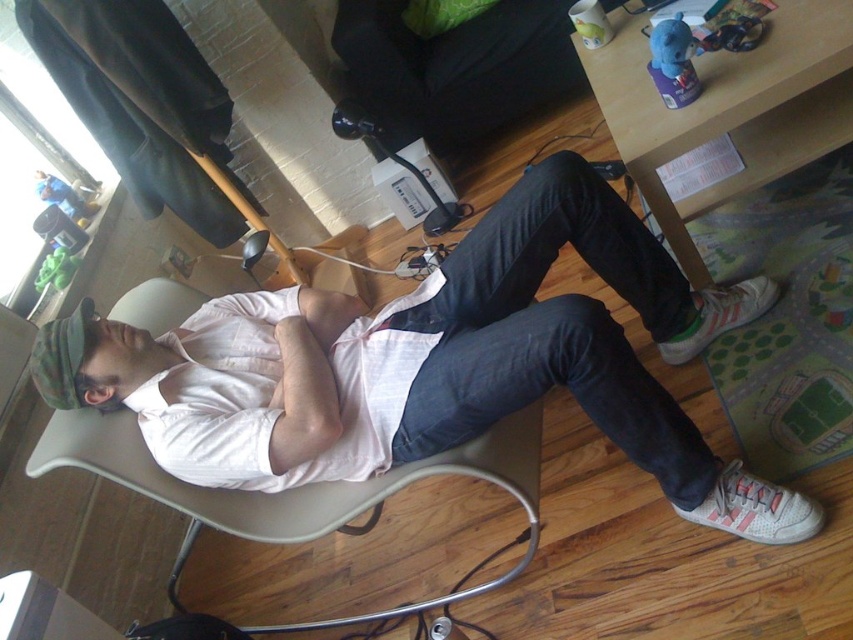
You are standing in the room and want to place a new plant on the closest object to you between the wooden table at lower right and the camouflage fabric cap at upper left. Which object should you choose?

The wooden table at lower right is closer to you than the camouflage fabric cap at upper left, so you should place the plant on the wooden table at lower right.

You are a photographer trying to capture the scene from above. You need to focus on the white cotton shirt at center and the wooden table at lower right. Which object should you adjust your camera angle to look down at first?

The white cotton shirt at center is located below the wooden table at lower right, so you should first adjust your camera angle to look down at the white cotton shirt at center since it is lower in position.